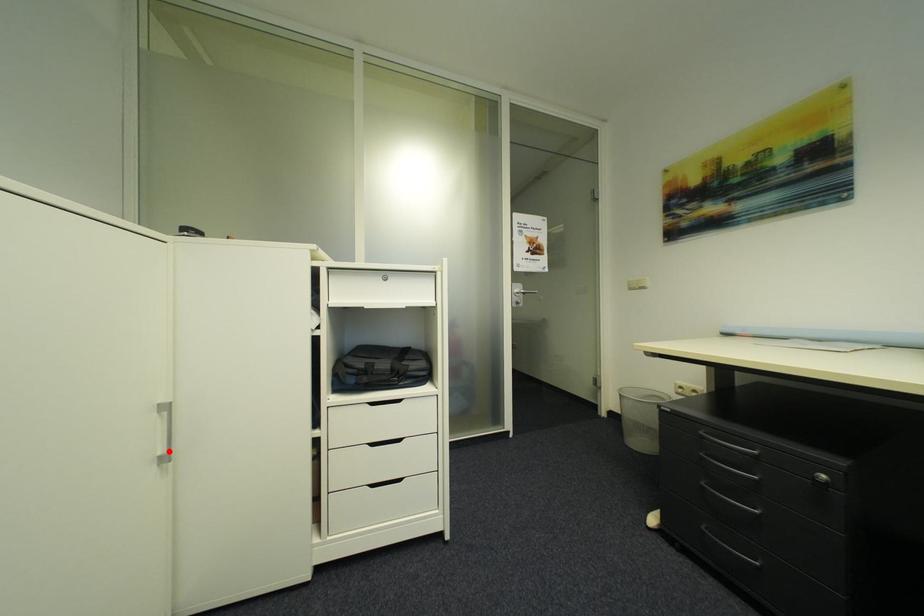
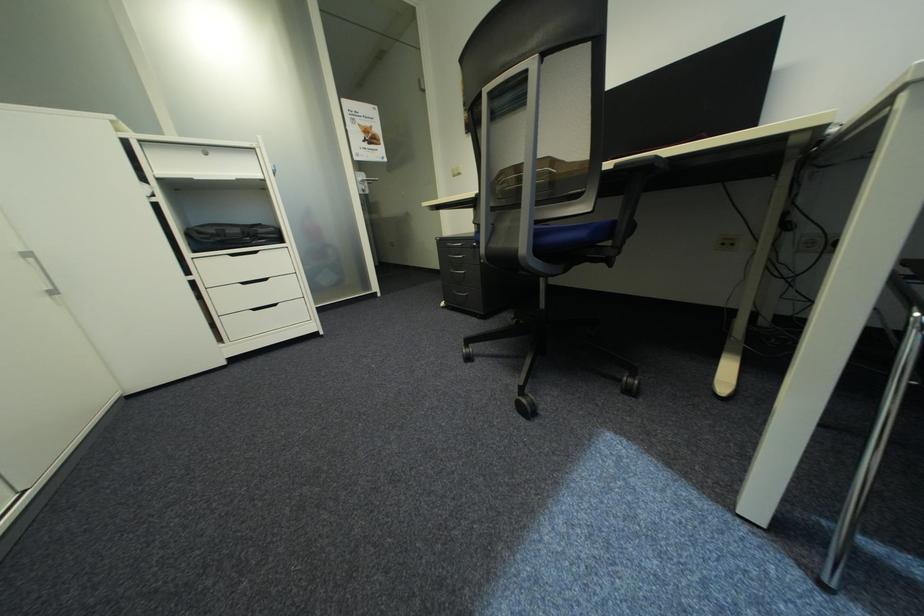
Locate, in the second image, the point that corresponds to the highlighted location in the first image.

(55, 288)